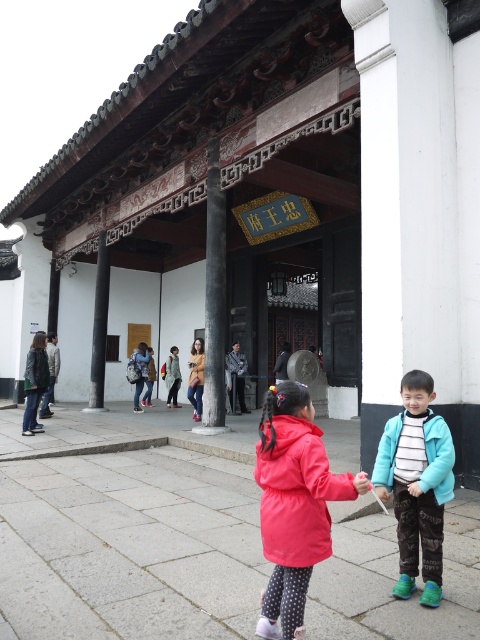
Question: Based on their relative distances, which object is nearer to the denim jacket at center?

Choices:
 (A) teal fleece jacket at center
 (B) striped cotton jacket at lower right
 (C) matte pink coat at center

Answer: (A)

Question: Can you confirm if matte pink coat at center is positioned above striped cotton jacket at lower right?

Choices:
 (A) yes
 (B) no

Answer: (B)

Question: Estimate the real-world distances between objects in this image. Which object is farther from the teal fleece jacket at center?

Choices:
 (A) denim jacket at center
 (B) striped cotton jacket at lower right

Answer: (A)

Question: In this image, where is teal fleece jacket at center located relative to striped cotton jacket at lower right?

Choices:
 (A) left
 (B) right

Answer: (A)

Question: Where is teal fleece jacket at center located in relation to denim jacket at center in the image?

Choices:
 (A) below
 (B) above

Answer: (B)

Question: Which point appears closest to the camera in this image?

Choices:
 (A) (297, 500)
 (B) (428, 513)
 (C) (200, 355)
 (D) (432, 461)

Answer: (A)